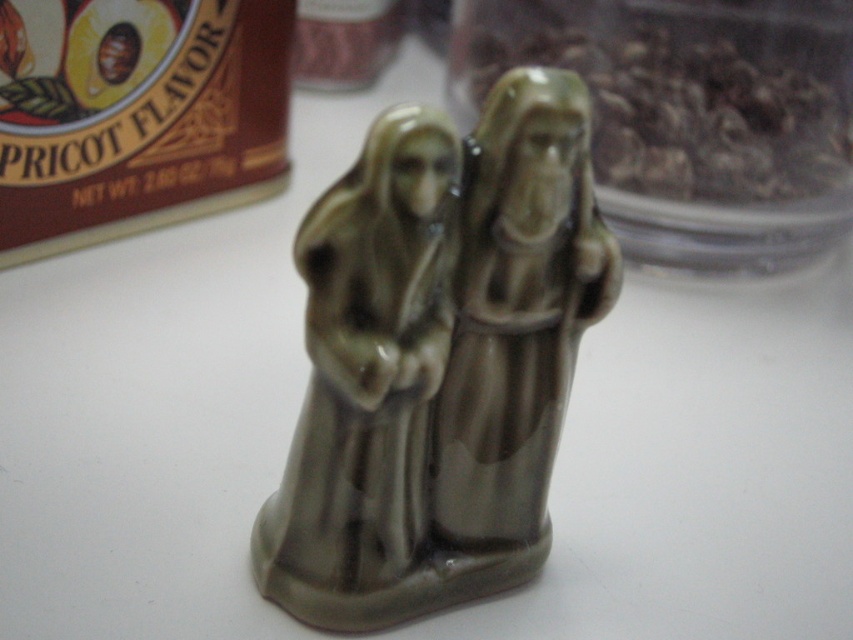
Is the position of matte ceramic figures at center less distant than that of translucent plastic jar at upper right?

Yes, matte ceramic figures at center is closer to the viewer.

Does matte ceramic figures at center have a greater height compared to translucent plastic jar at upper right?

Correct, matte ceramic figures at center is much taller as translucent plastic jar at upper right.

Is point (402, 381) positioned after point (758, 125)?

No.

This screenshot has width=853, height=640. What are the coordinates of `matte ceramic figures at center` in the screenshot? It's located at (437, 358).